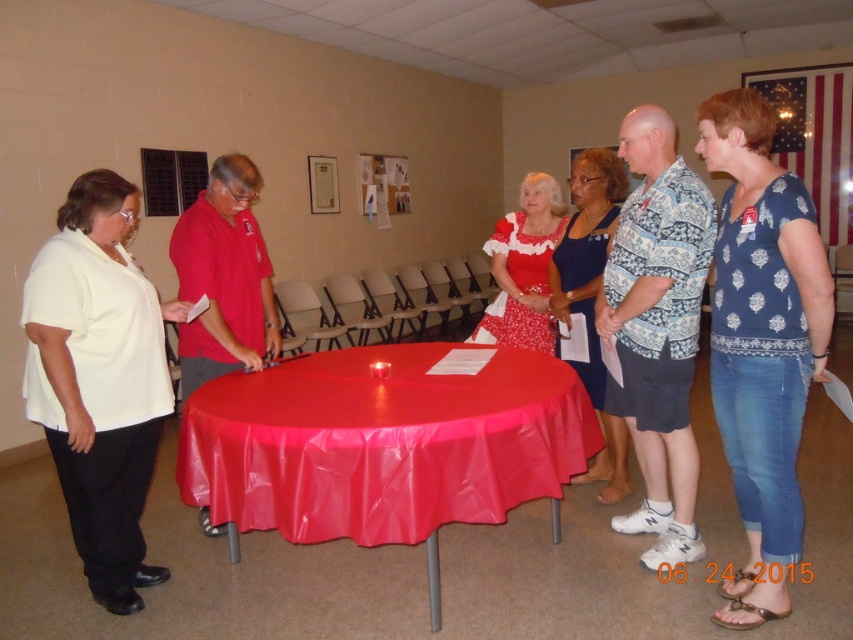
Question: Which object appears closest to the camera in this image?

Choices:
 (A) white matte shirt at left
 (B) blue printed blouse at center

Answer: (B)

Question: Does shiny plastic tablecloth at center have a larger size compared to blue printed blouse at center?

Choices:
 (A) no
 (B) yes

Answer: (B)

Question: Which object is positioned closest to the shiny plastic tablecloth at center?

Choices:
 (A) blue printed blouse at center
 (B) white matte shirt at left

Answer: (B)

Question: In this image, where is shiny plastic tablecloth at center located relative to matte red dress at center?

Choices:
 (A) right
 (B) left

Answer: (B)

Question: Is blue printed blouse at center to the left of blue printed dress at center from the viewer's perspective?

Choices:
 (A) yes
 (B) no

Answer: (B)

Question: Which is nearer to the white matte shirt at left?

Choices:
 (A) blue printed dress at center
 (B) matte red dress at center
 (C) blue printed blouse at center

Answer: (B)